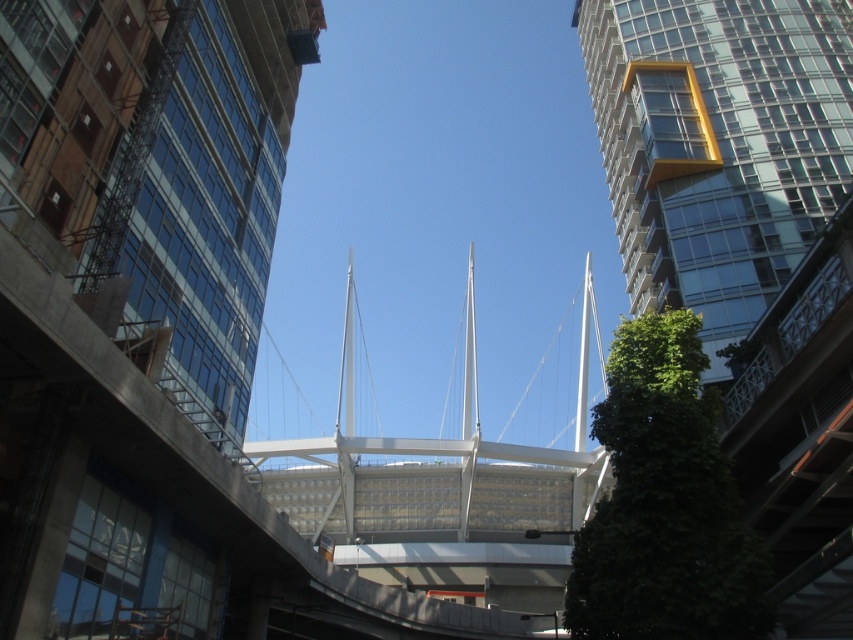
Does clear glass building at upper left have a greater height compared to transparent glass tower at right?

No.

Is point (227, 104) farther from viewer compared to point (802, 161)?

No, (227, 104) is in front of (802, 161).

Where is `clear glass building at upper left`? clear glass building at upper left is located at coordinates (155, 179).